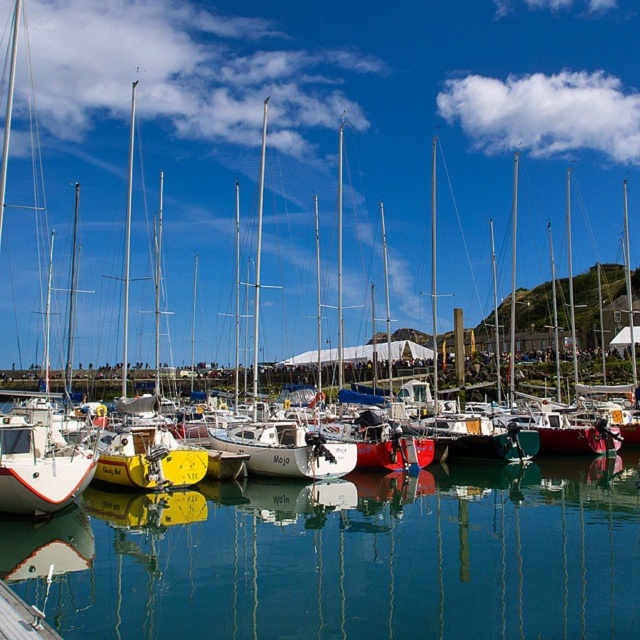
What do you see at coordinates (38, 467) in the screenshot? I see `white matte sailboat at left` at bounding box center [38, 467].

Image resolution: width=640 pixels, height=640 pixels. Find the location of `white matte sailboat at left`. white matte sailboat at left is located at coordinates (38, 467).

Does clear glass water at center appear on the right side of white matte sailboat at center?

Correct, you'll find clear glass water at center to the right of white matte sailboat at center.

Can you confirm if clear glass water at center is positioned below white matte sailboat at center?

Indeed, clear glass water at center is positioned under white matte sailboat at center.

Is point (582, 557) more distant than point (349, 452)?

No, (582, 557) is closer to viewer.

The height and width of the screenshot is (640, 640). In order to click on clear glass water at center in this screenshot , I will do `click(348, 557)`.

Which of these two, clear glass water at center or white matte sailboat at left, stands taller?

Standing taller between the two is white matte sailboat at left.

Can you confirm if clear glass water at center is positioned to the left of white matte sailboat at left?

In fact, clear glass water at center is to the right of white matte sailboat at left.

Which is behind, point (538, 540) or point (77, 468)?

The point (538, 540) is more distant.

This screenshot has width=640, height=640. I want to click on clear glass water at center, so click(348, 557).